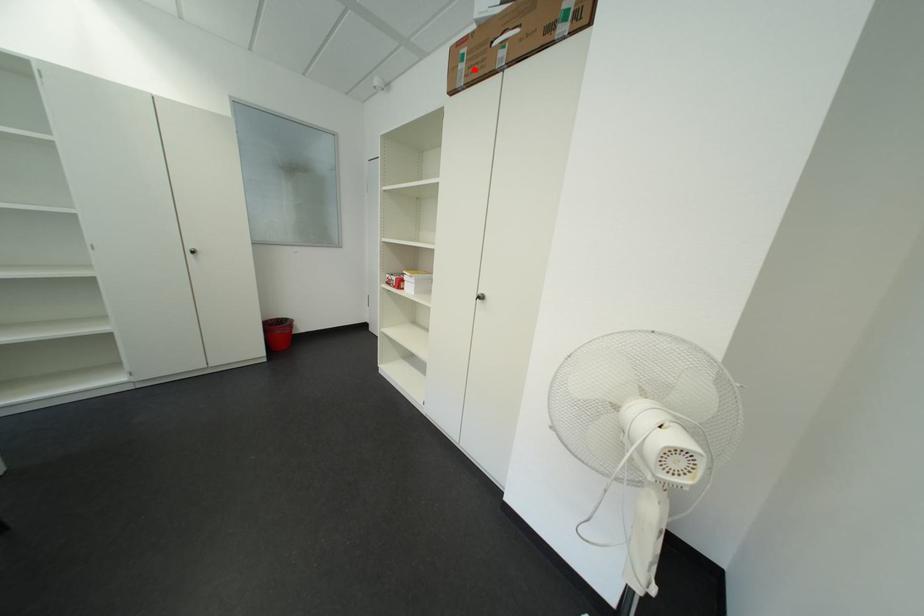
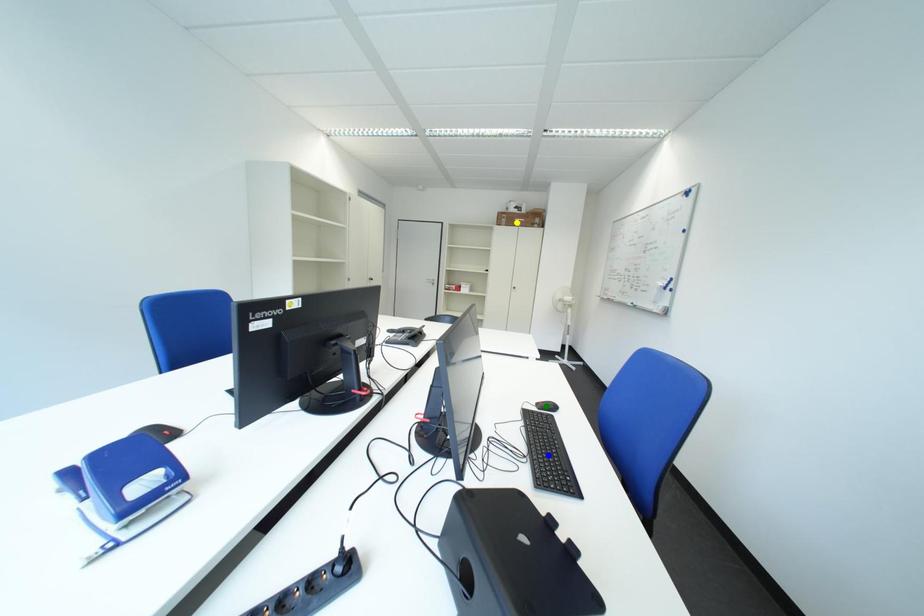
Question: I am providing you with two images of the same scene from different viewpoints. A red point is marked on the first image. You are given multiple points on the second image. Which point in image 2 is actually the same real-world point as the red point in image 1?

Choices:
 (A) green point
 (B) blue point
 (C) yellow point

Answer: (C)